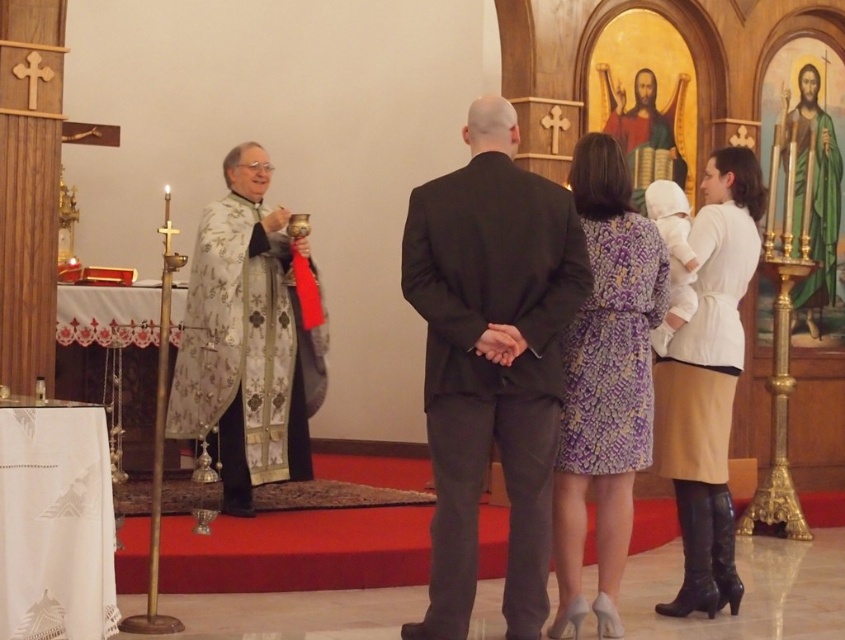
Between black matte suit at center and purple printed dress at center, which one has more height?

black matte suit at center

Can you confirm if black matte suit at center is positioned to the left of purple printed dress at center?

Correct, you'll find black matte suit at center to the left of purple printed dress at center.

Between point (478, 417) and point (606, 605), which one is positioned behind?

Point (606, 605)

Identify the location of black matte suit at center. The height and width of the screenshot is (640, 845). (491, 360).

Between point (482, 218) and point (217, 224), which one is positioned behind?

Point (217, 224)

Between point (544, 488) and point (178, 429), which one is positioned in front?

Positioned in front is point (544, 488).

Between point (478, 461) and point (238, 442), which one is positioned behind?

Point (238, 442)

Where is `black matte suit at center`? black matte suit at center is located at coordinates (491, 360).

Between silver embroidered robe at left and purple printed dress at center, which one is positioned higher?

Positioned higher is silver embroidered robe at left.

Can you confirm if silver embroidered robe at left is thinner than purple printed dress at center?

In fact, silver embroidered robe at left might be wider than purple printed dress at center.

Image resolution: width=845 pixels, height=640 pixels. Find the location of `silver embroidered robe at left`. silver embroidered robe at left is located at coordinates (246, 340).